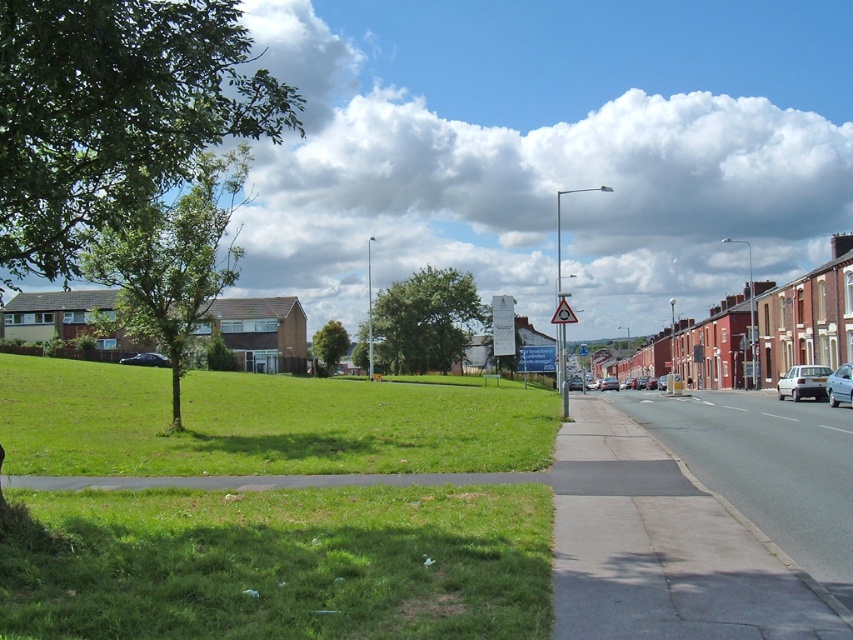
In the scene shown: You are standing on the suburban street and see two points marked on the ground. The first point is at coordinate point (840,401) and the second point is at coordinate point (163,355). Which point is closer to you?

Point (840,401) is closer to the viewer than point (163,355).

You are standing at the center of the grassy area and want to walk to the metallic silver sedan at right. Which direction should you head?

You should head to the right direction since the metallic silver sedan at right is located at the right side of the image.

Consider the image. You are standing at the center of the grassy area and want to walk to the metallic silver sedan at right. Which direction should you walk to reach it?

You should walk towards the right side of the grassy area to reach the metallic silver sedan at right.